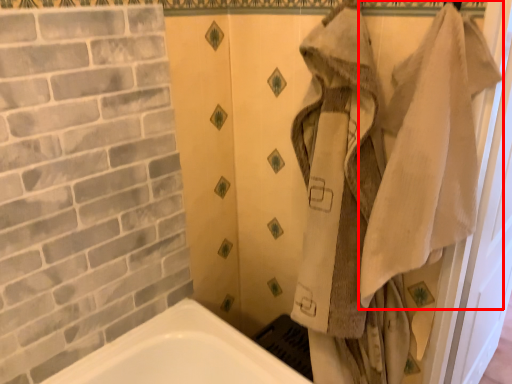
Question: From the image's perspective, what is the correct spatial positioning of bath towel (annotated by the red box) in reference to screen door?

Choices:
 (A) above
 (B) below

Answer: (A)